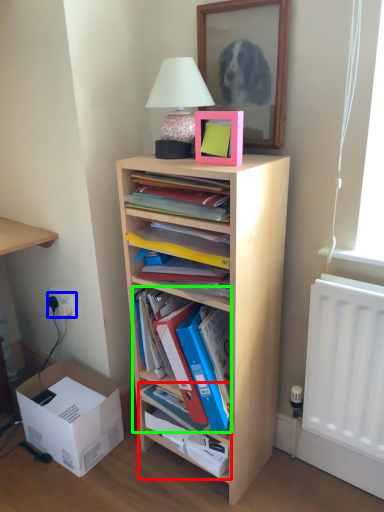
Question: Which object is positioned closest to cabinet (highlighted by a red box)? Select from electric outlet (highlighted by a blue box) and shelf (highlighted by a green box).

Choices:
 (A) electric outlet
 (B) shelf

Answer: (B)